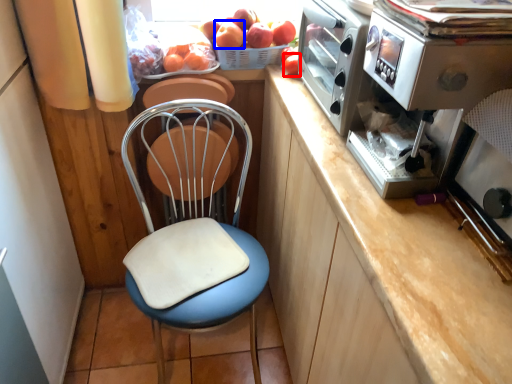
Question: Which object appears farthest to the camera in this image, fruit (highlighted by a red box) or apple (highlighted by a blue box)?

Choices:
 (A) fruit
 (B) apple

Answer: (B)